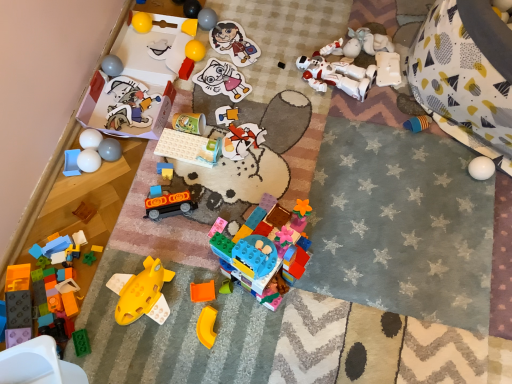
The width and height of the screenshot is (512, 384). In order to click on free space to the left of matte gray ball at upper left, acting as the 7th toy starting from the left in this screenshot , I will do `click(66, 168)`.